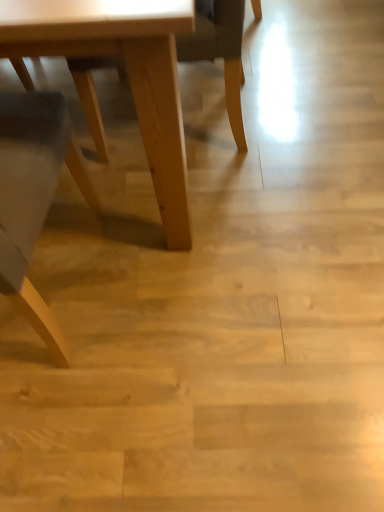
In order to click on unoccupied region to the right of light brown wood chair at center in this screenshot , I will do `click(310, 102)`.